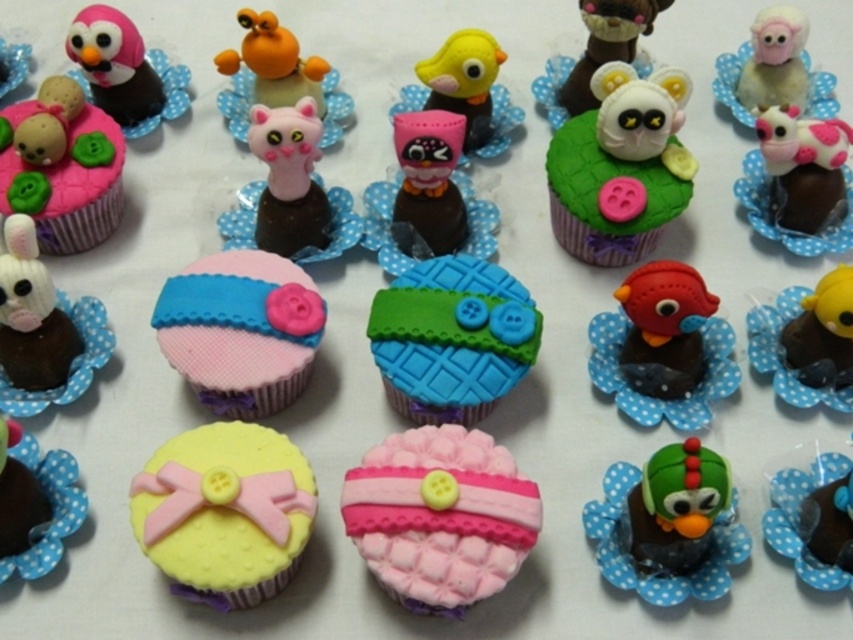
You are a child who wants to reach for the tallest figurine among the green matte bird at lower right and the orange matte toy at upper center. Which one should you choose?

The green matte bird at lower right is taller than the orange matte toy at upper center, so you should choose the green matte bird at lower right.

You are a baker arranging cupcakes on a display. You have a green matte bird at lower right and an orange matte toy at upper center. Which figurine takes up more horizontal space on its cupcake?

The orange matte toy at upper center takes up more horizontal space on its cupcake because it is thicker than the green matte bird at lower right.